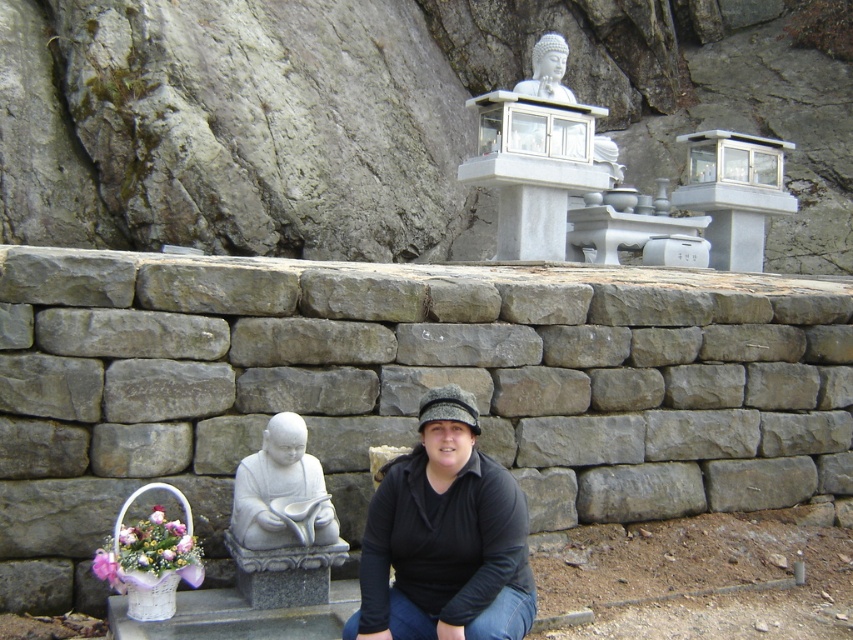
Question: Which object is the closest to the white stone statue at upper center?

Choices:
 (A) black fabric squat at center
 (B) white stone statue at lower left

Answer: (B)

Question: Does black fabric squat at center appear over white stone statue at lower left?

Choices:
 (A) yes
 (B) no

Answer: (B)

Question: Which of these objects is positioned closest to the black fabric squat at center?

Choices:
 (A) white stone statue at lower left
 (B) white stone statue at upper center

Answer: (A)

Question: Does black fabric squat at center appear on the right side of white stone statue at lower left?

Choices:
 (A) yes
 (B) no

Answer: (A)

Question: Is white stone statue at lower left smaller than white stone statue at upper center?

Choices:
 (A) yes
 (B) no

Answer: (A)

Question: Among these points, which one is farthest from the camera?

Choices:
 (A) (282, 525)
 (B) (538, 44)
 (C) (479, 470)

Answer: (B)